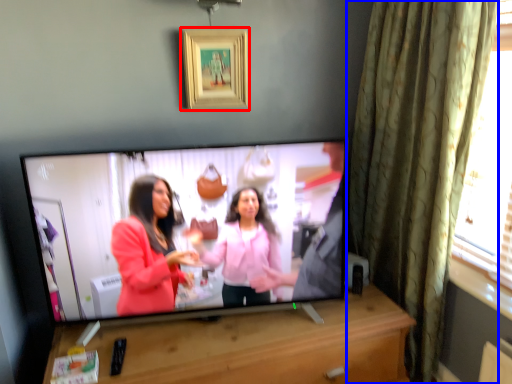
Question: Which object appears closest to the camera in this image, picture frame (highlighted by a red box) or curtain (highlighted by a blue box)?

Choices:
 (A) picture frame
 (B) curtain

Answer: (B)